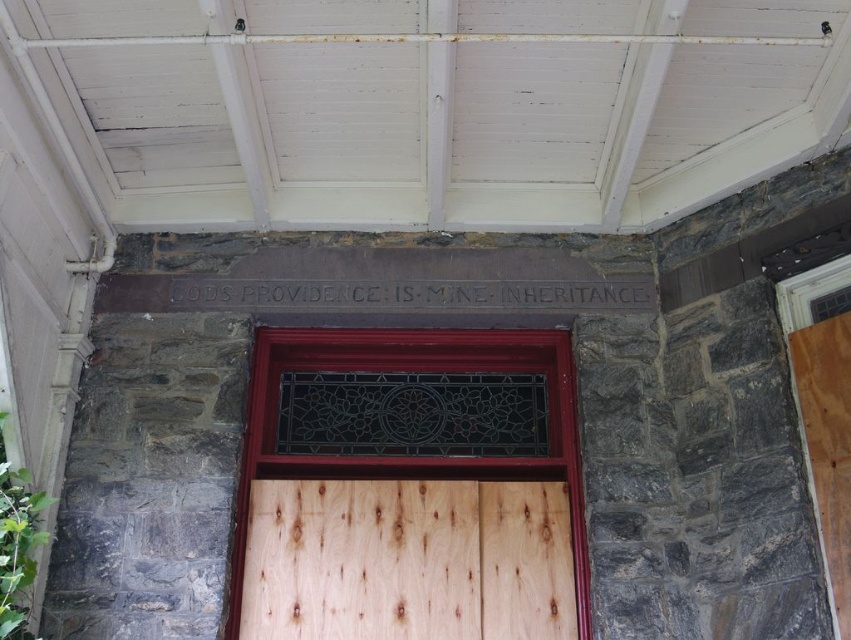
Is wooden door at center taller than natural wood door at center?

Correct, wooden door at center is much taller as natural wood door at center.

Is wooden door at center above natural wood door at center?

Indeed, wooden door at center is positioned over natural wood door at center.

Is point (355, 561) farther from camera compared to point (353, 632)?

Yes.

Locate an element on the screen. The height and width of the screenshot is (640, 851). wooden door at center is located at coordinates (410, 488).